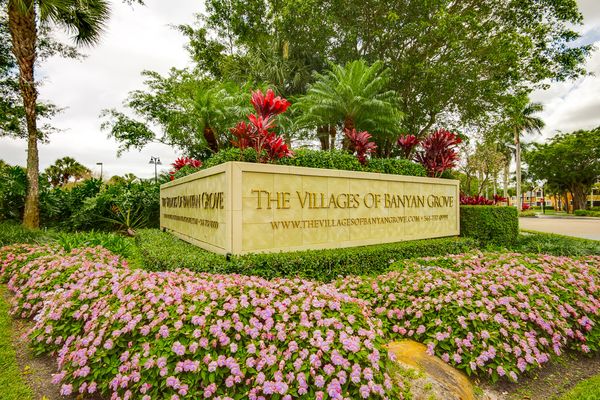
Locate an element on the screen. This screenshot has width=600, height=400. lamp is located at coordinates (99, 162).